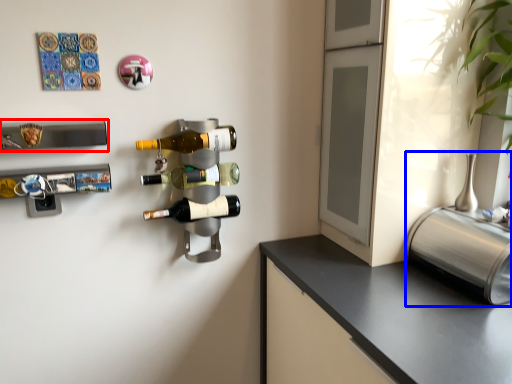
Question: Which of the following is the closest to the observer, wine rack (highlighted by a red box) or appliance (highlighted by a blue box)?

Choices:
 (A) wine rack
 (B) appliance

Answer: (B)